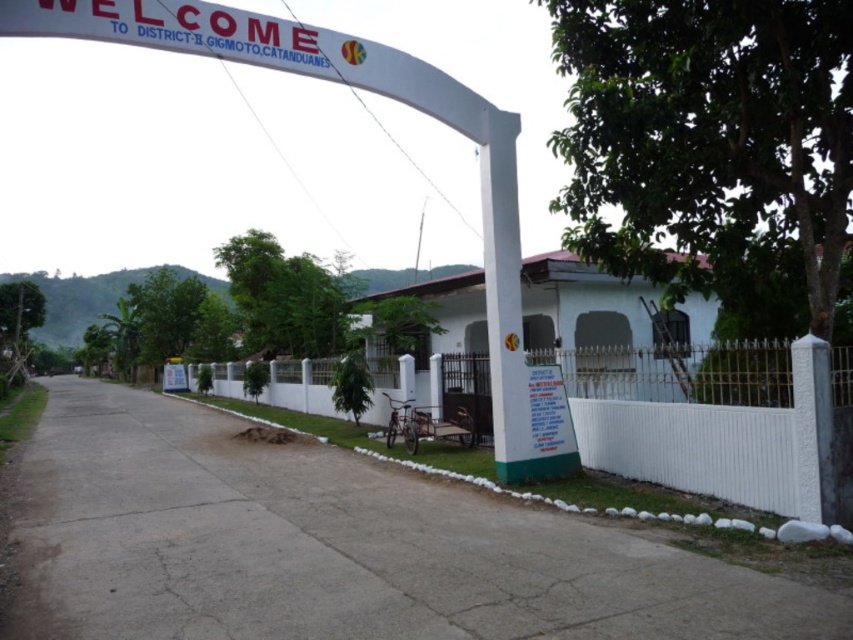
Question: Can you confirm if white painted metal fence at center is wider than white matte building at center?

Choices:
 (A) no
 (B) yes

Answer: (A)

Question: Which of the following is the closest to the observer?

Choices:
 (A) (675, 344)
 (B) (793, 472)

Answer: (B)

Question: Which object appears farthest from the camera in this image?

Choices:
 (A) white matte building at center
 (B) white painted metal fence at center

Answer: (A)

Question: Does white painted metal fence at center have a larger size compared to white matte building at center?

Choices:
 (A) yes
 (B) no

Answer: (B)

Question: Is white painted metal fence at center closer to camera compared to white matte building at center?

Choices:
 (A) yes
 (B) no

Answer: (A)